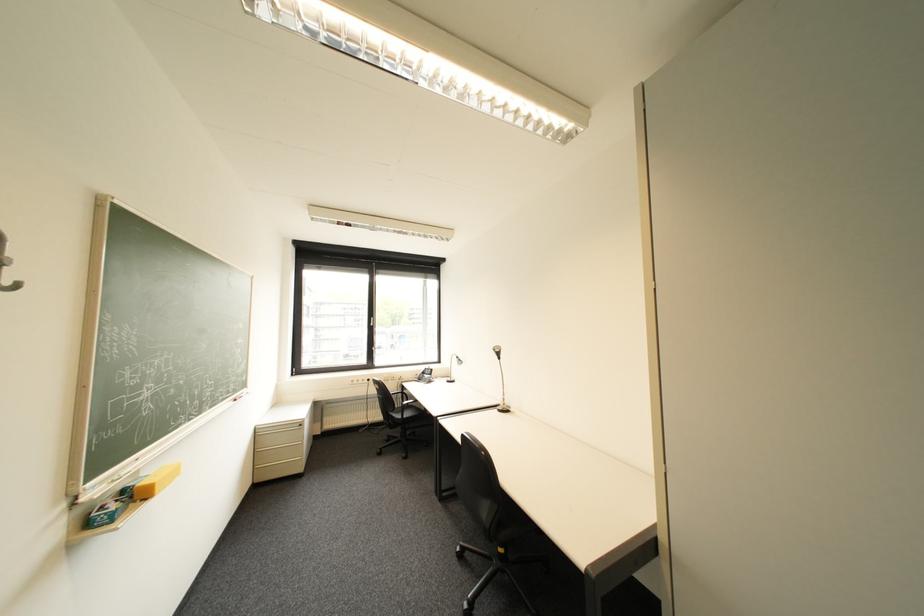
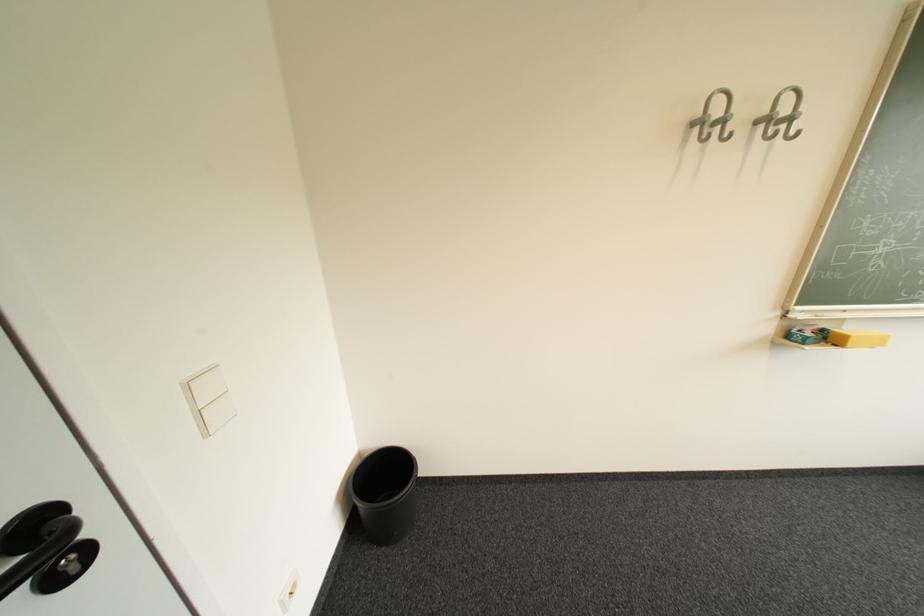
In the second image, find the point that corresponds to (x=155, y=500) in the first image.

(846, 346)